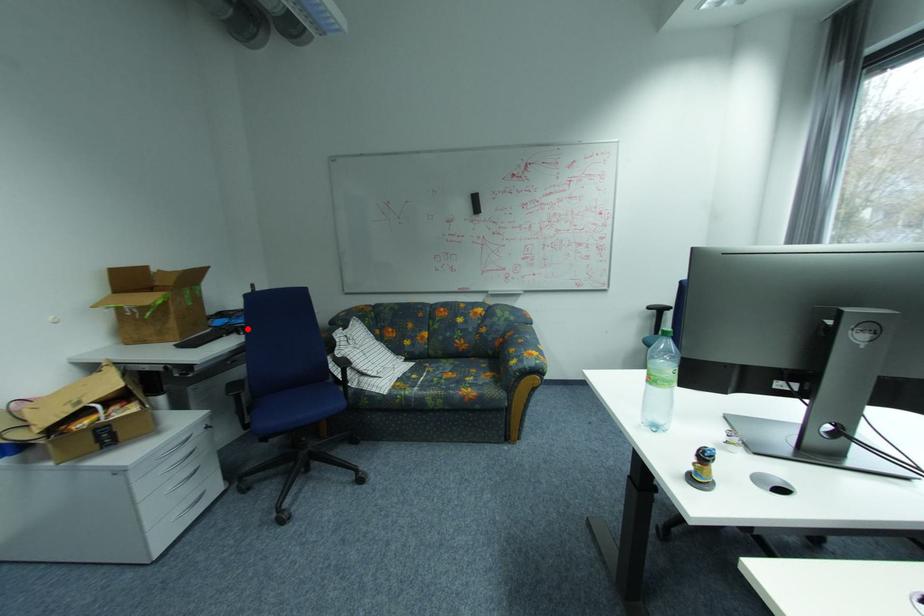
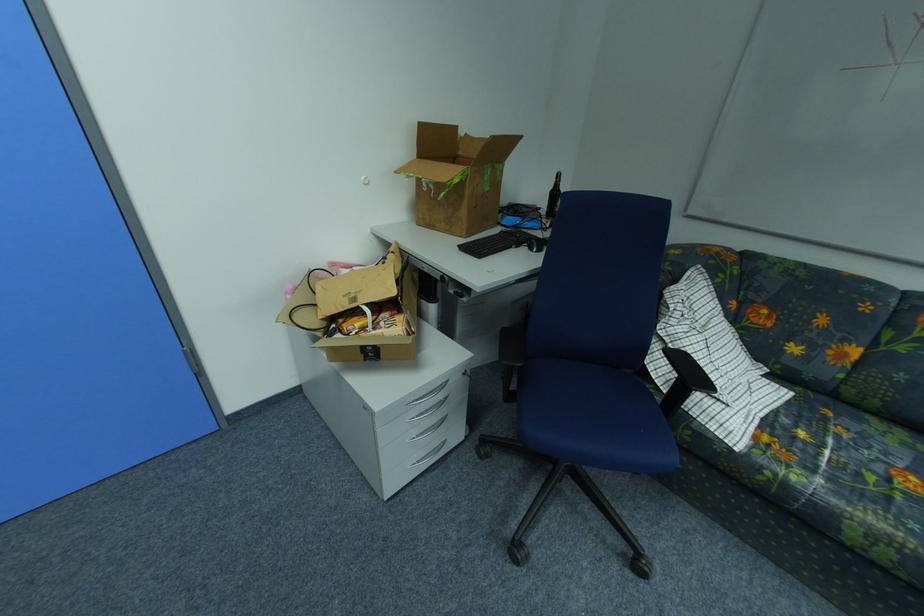
Question: A red point is marked in image1. In image2, is the corresponding 3D point closer to the camera or farther? Reply with the corresponding letter.

Choices:
 (A) The corresponding 3D point is closer.
 (B) The corresponding 3D point is farther.

Answer: (A)